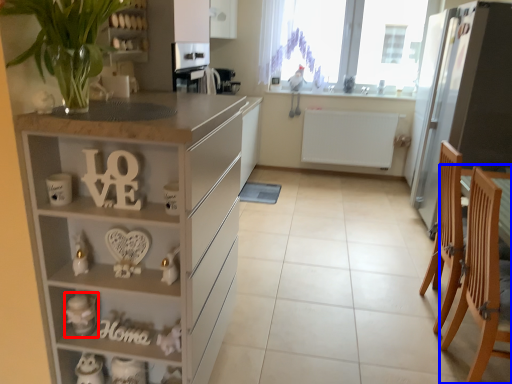
Question: Among these objects, which one is nearest to the camera, toy (highlighted by a red box) or armchair (highlighted by a blue box)?

Choices:
 (A) toy
 (B) armchair

Answer: (B)